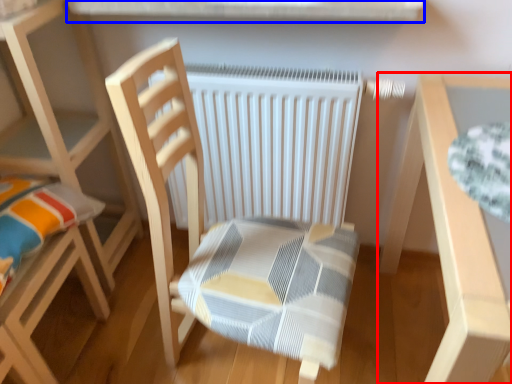
Question: Which object is further to the camera taking this photo, table (highlighted by a red box) or window sill (highlighted by a blue box)?

Choices:
 (A) table
 (B) window sill

Answer: (B)